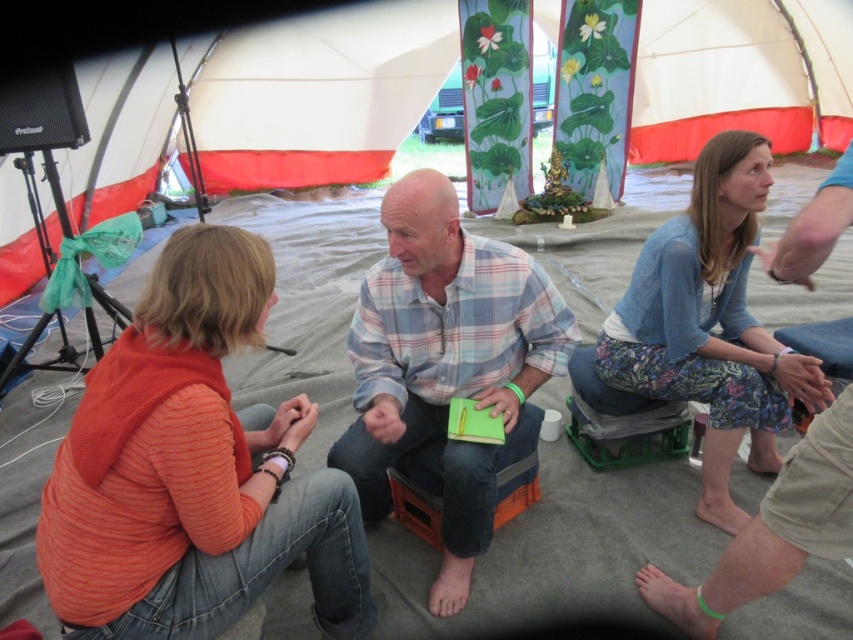
From the picture: Who is more forward, (187, 528) or (444, 540)?

Positioned in front is point (187, 528).

Is orange sweater at lower left wider than plaid shirt at center?

In fact, orange sweater at lower left might be narrower than plaid shirt at center.

Where is `orange sweater at lower left`? orange sweater at lower left is located at coordinates (192, 470).

What do you see at coordinates (192, 470) in the screenshot? I see `orange sweater at lower left` at bounding box center [192, 470].

Which is behind, point (161, 355) or point (639, 264)?

The point (639, 264) is behind.

The width and height of the screenshot is (853, 640). Describe the element at coordinates (192, 470) in the screenshot. I see `orange sweater at lower left` at that location.

You are a GUI agent. You are given a task and a screenshot of the screen. Output one action in this format:
    pyautogui.click(x=<x>, y=<y>)
    Task: Click on the orange sweater at lower left
    The width and height of the screenshot is (853, 640).
    Given the screenshot: What is the action you would take?
    pyautogui.click(x=192, y=470)

The width and height of the screenshot is (853, 640). What do you see at coordinates (440, 333) in the screenshot?
I see `plaid shirt at center` at bounding box center [440, 333].

The image size is (853, 640). Find the location of `plaid shirt at center`. plaid shirt at center is located at coordinates (440, 333).